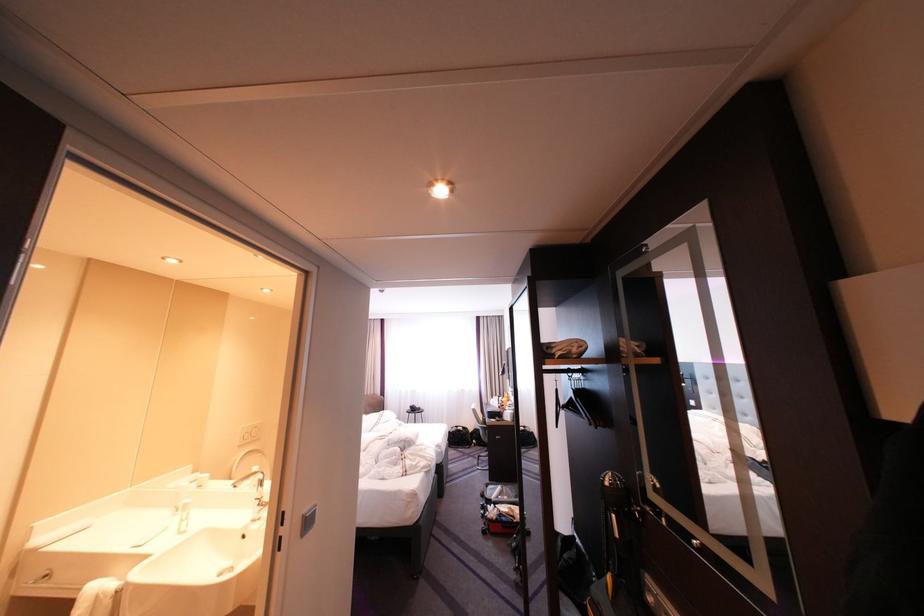
I want to click on chair sitting surface, so click(x=496, y=419).